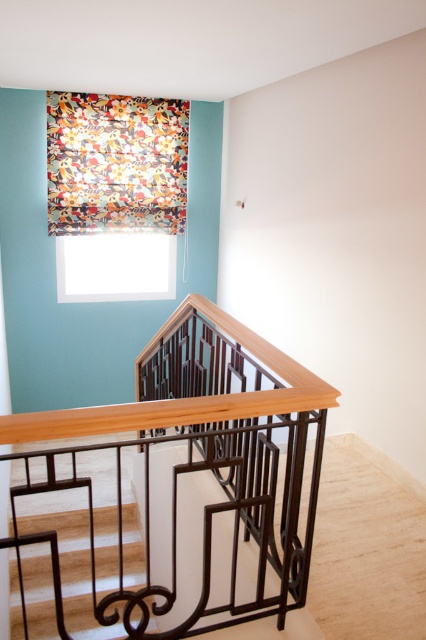
You are a painter who needs to paint the wall behind the woodenmetallicbalustrade at center and the floral fabric at upper left. Which object should you paint first if you want to start with the one closer to the ceiling?

The floral fabric at upper left should be painted first because it is closer to the ceiling than the woodenmetallicbalustrade at center.

You are a painter who needs to hang a 10 inch wide painting between the floral fabric at upper left and the white matte window at upper center. Can the painting fit in the space between them?

The distance between the floral fabric at upper left and the white matte window at upper center is 9.96 inches, which is slightly less than the painting width of 10 inches. Therefore, the painting cannot fit between them.